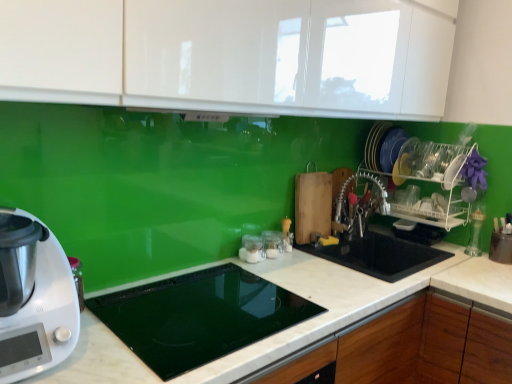
The image size is (512, 384). I want to click on free location above white marble countertop at center (from a real-world perspective), so click(252, 293).